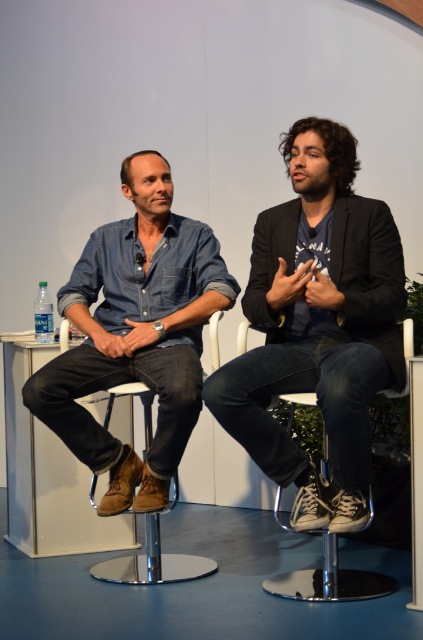
Question: Is dark blue denim jeans at center to the left of denim shirt at left from the viewer's perspective?

Choices:
 (A) no
 (B) yes

Answer: (A)

Question: Is dark blue denim jeans at center to the right of brown leather stool at center from the viewer's perspective?

Choices:
 (A) no
 (B) yes

Answer: (B)

Question: Among these objects, which one is farthest from the camera?

Choices:
 (A) dark blue denim jeans at center
 (B) brown leather stool at center

Answer: (B)

Question: Can you confirm if denim shirt at left is positioned to the right of brown leather stool at center?

Choices:
 (A) yes
 (B) no

Answer: (B)

Question: Estimate the real-world distances between objects in this image. Which object is closer to the brown leather stool at center?

Choices:
 (A) dark blue denim jeans at center
 (B) denim shirt at left

Answer: (B)

Question: Which point is closer to the camera taking this photo?

Choices:
 (A) (173, 554)
 (B) (294, 358)
 (C) (165, 396)

Answer: (B)